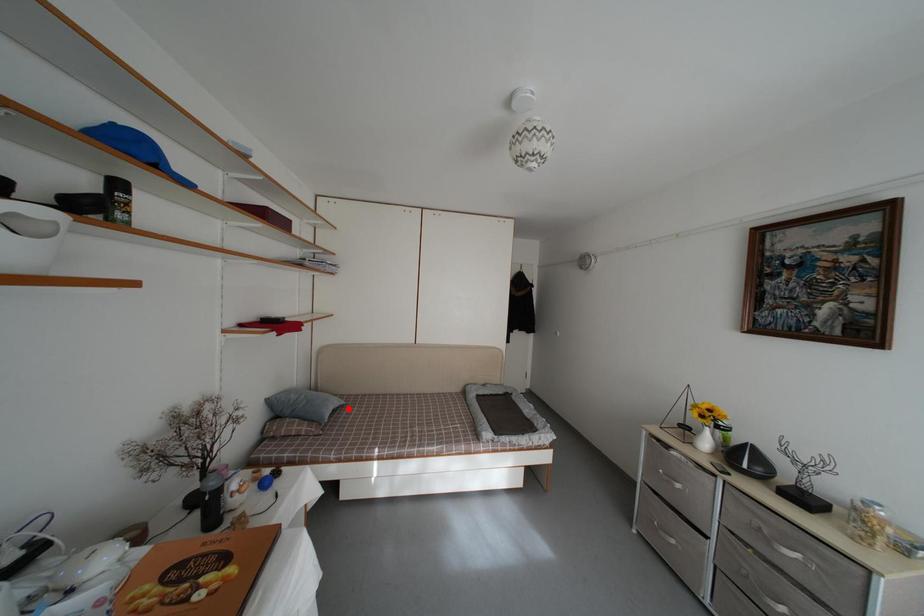
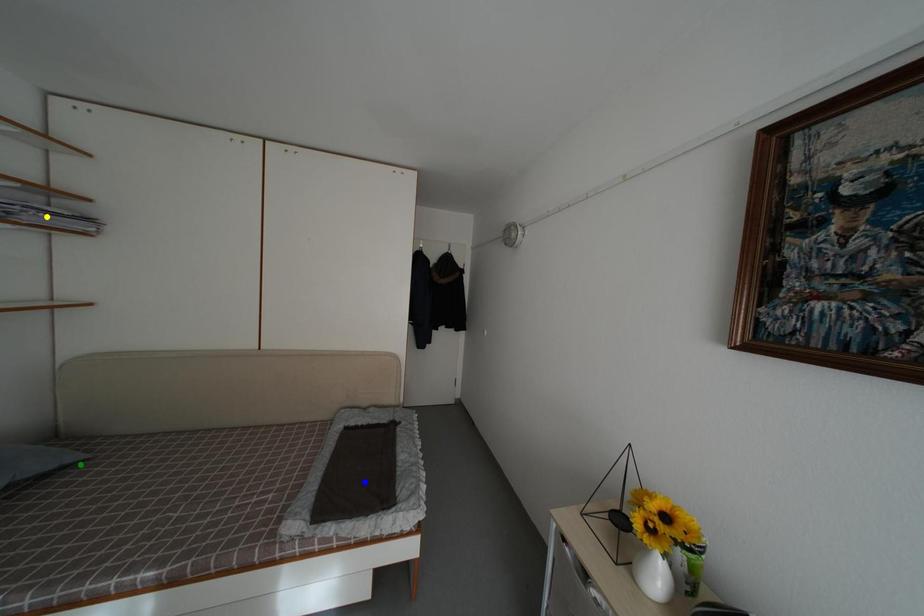
Question: I am providing you with two images of the same scene from different viewpoints. A red point is marked on the first image. You are given multiple points on the second image. Which mark in image 2 goes with the point in image 1?

Choices:
 (A) yellow point
 (B) green point
 (C) blue point

Answer: (B)